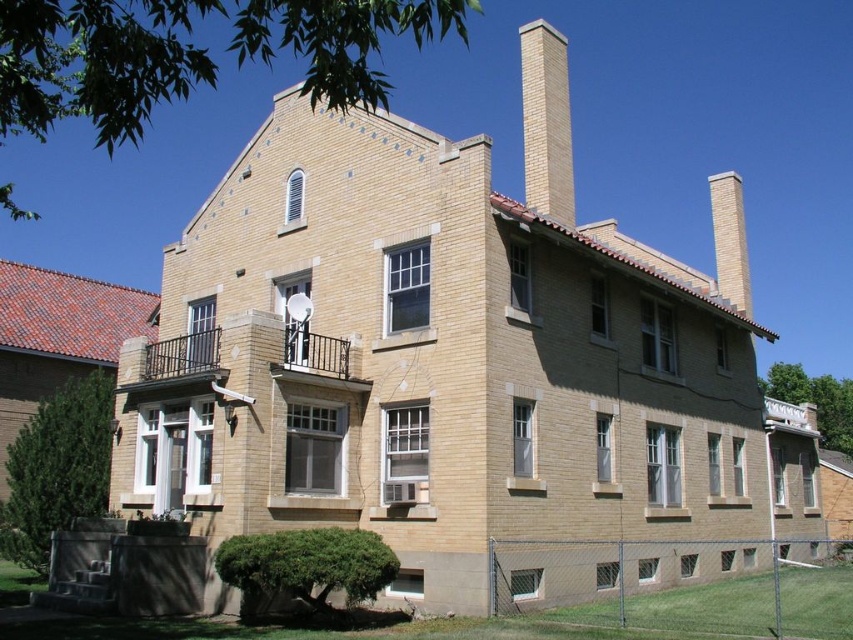
Which is in front, point (543, 74) or point (734, 241)?

Point (543, 74) is more forward.

How much distance is there between yellow brick chimney at upper center and smooth tan brick chimney at upper right?

yellow brick chimney at upper center is 149.64 feet from smooth tan brick chimney at upper right.

What do you see at coordinates (546, 122) in the screenshot?
I see `yellow brick chimney at upper center` at bounding box center [546, 122].

Identify the location of yellow brick chimney at upper center. Image resolution: width=853 pixels, height=640 pixels. (546, 122).

Which is above, metallic chain-link fence at lower right or smooth tan brick chimney at upper right?

smooth tan brick chimney at upper right is higher up.

Which is below, metallic chain-link fence at lower right or smooth tan brick chimney at upper right?

metallic chain-link fence at lower right

Is point (677, 630) behind point (724, 282)?

No, it is not.

Locate an element on the screen. metallic chain-link fence at lower right is located at coordinates (677, 584).

How far apart are metallic chain-link fence at lower right and yellow brick chimney at upper center?

They are 121.91 feet apart.

Does metallic chain-link fence at lower right lie behind yellow brick chimney at upper center?

No, it is not.

Is point (605, 618) positioned before point (549, 145)?

That is True.

Find the location of a particular element. metallic chain-link fence at lower right is located at coordinates (677, 584).